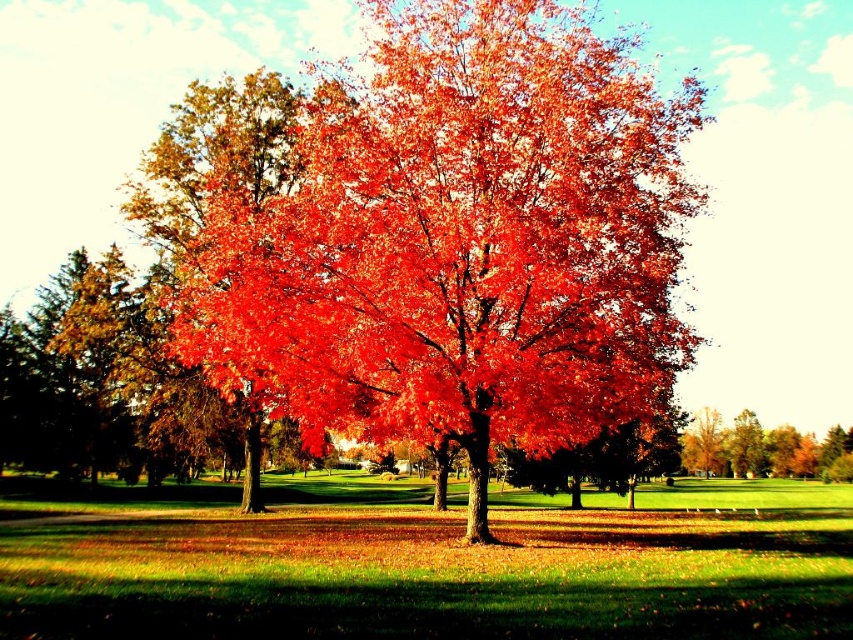
You are standing at the center of the autumn scene. There is a point marked at coordinates (460, 241). What object is located at that point?

The point at coordinates (460, 241) corresponds to the shiny red maple tree at center.

You are standing at the center of the image and want to walk towards the shiny red maple tree at center. In which direction should you move?

Since the shiny red maple tree at center is already at the center of the image, you are already facing it. No need to move in any direction.